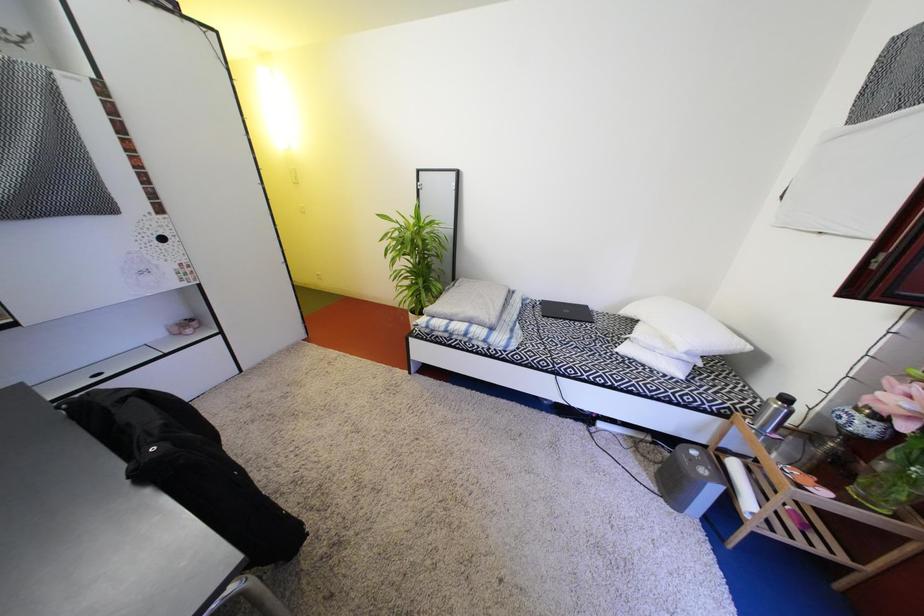
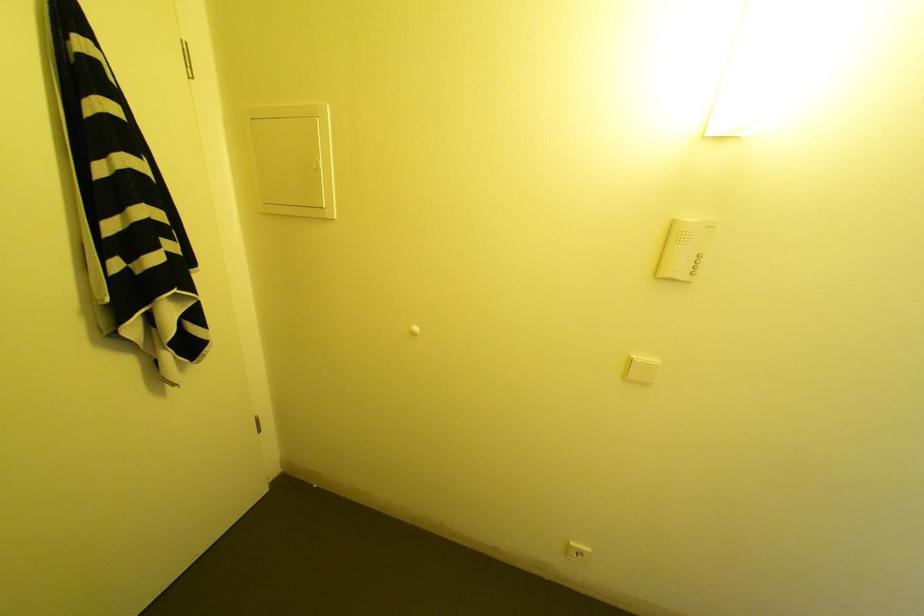
In the scene shown: What movement of the cameraman would produce the second image?

The movement direction of the cameraman is left, forward.